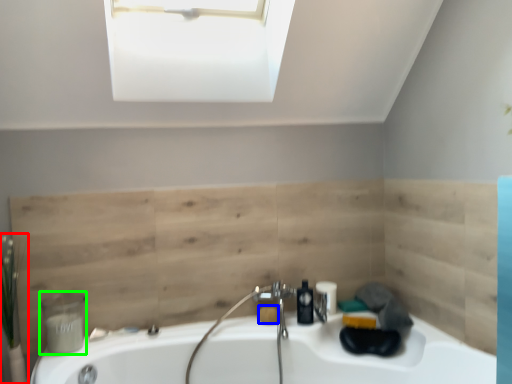
Question: Which is nearer to the plant (highlighted by a red box)? soap (highlighted by a blue box) or toiletry (highlighted by a green box).

Choices:
 (A) soap
 (B) toiletry

Answer: (B)